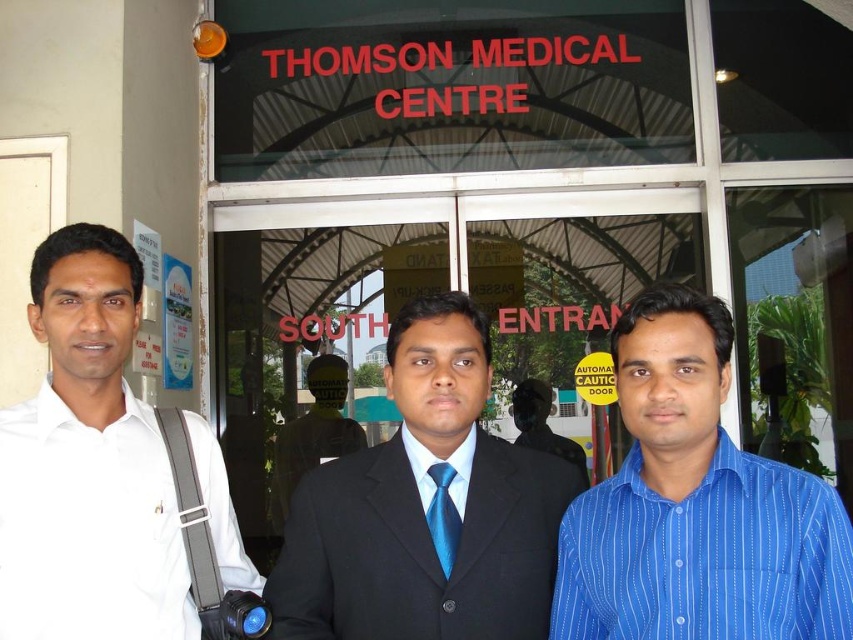
Is blue silk suit at center wider than blue satin tie at center?

Yes, blue silk suit at center is wider than blue satin tie at center.

Between blue silk suit at center and blue satin tie at center, which one has less height?

blue satin tie at center

Does point (540, 394) come closer to viewer compared to point (444, 497)?

That is False.

This screenshot has height=640, width=853. I want to click on blue silk suit at center, so click(543, 424).

Is blue tie at center further to the viewer compared to blue satin tie at center?

Yes, it is.

Is point (340, 445) positioned behind point (433, 532)?

Yes, point (340, 445) is farther from viewer.

Who is more distant from viewer, (321, 358) or (428, 520)?

The point (321, 358) is more distant.

You are a GUI agent. You are given a task and a screenshot of the screen. Output one action in this format:
    pyautogui.click(x=<x>, y=<y>)
    Task: Click on the blue tie at center
    
    Given the screenshot: What is the action you would take?
    pyautogui.click(x=312, y=433)

Between black suit at center and blue tie at center, which one appears on the right side from the viewer's perspective?

From the viewer's perspective, black suit at center appears more on the right side.

Where is `black suit at center`? The width and height of the screenshot is (853, 640). black suit at center is located at coordinates (425, 508).